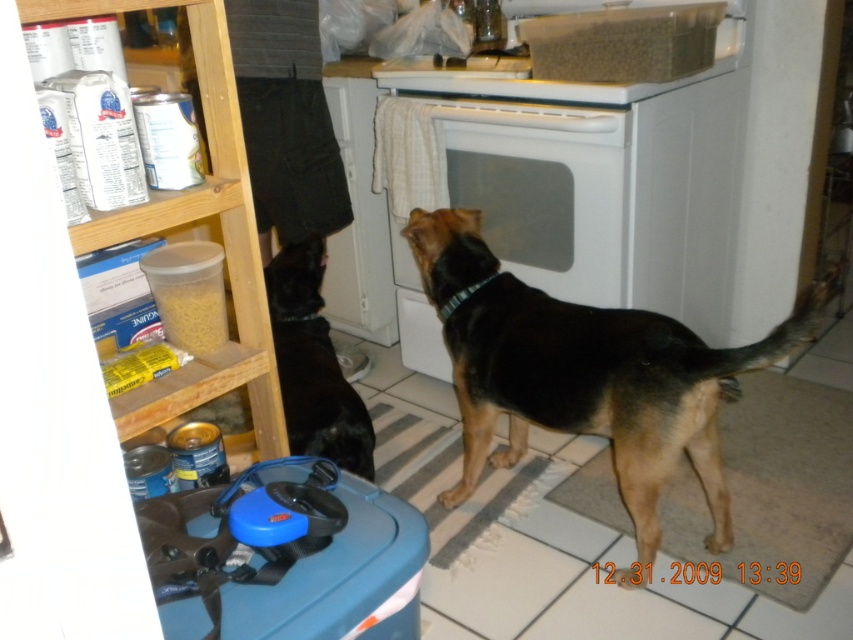
You are a dog owner who wants to feed your dogs. You see the white matte oven at center and the black fur dog at center. Which object is closer to the right side of the image?

The white matte oven at center is to the right of the black fur dog at center, so the white matte oven at center is closer to the right side of the image.

You are a dog trainer observing two dogs in a kitchen. You need to determine which dog is wider. The dogs are the brown fur dog at center and the black fur dog at center. Can you tell me which one is wider?

The brown fur dog at center is wider than the black fur dog at center according to the description provided.

You are standing in the kitchen and want to reach the white matte oven at center to preheat it. Considering your height is 5 feet 6 inches, can you comfortably reach the oven controls?

The white matte oven at center is 5.77 feet from viewer. Since your height is 5 feet 6 inches, you can comfortably reach the oven controls as the distance is within a typical comfortable reach range for someone of your height.